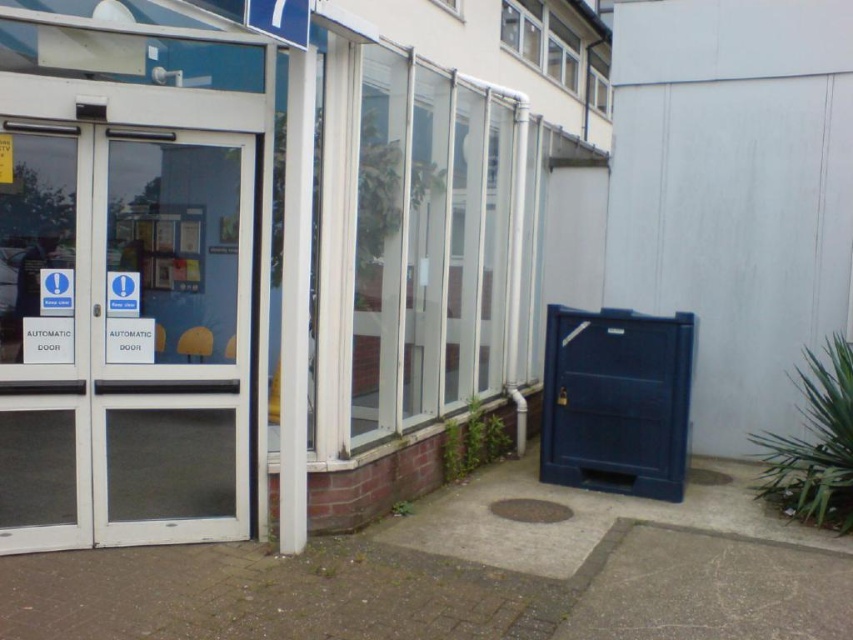
Question: Does transparent glass door at left have a smaller size compared to transparent glass door at center?

Choices:
 (A) no
 (B) yes

Answer: (B)

Question: Does transparent glass door at left have a lesser width compared to transparent glass door at center?

Choices:
 (A) yes
 (B) no

Answer: (B)

Question: Which object appears farthest from the camera in this image?

Choices:
 (A) transparent glass door at center
 (B) transparent glass door at left

Answer: (A)

Question: Does transparent glass door at left have a lesser width compared to transparent glass door at center?

Choices:
 (A) yes
 (B) no

Answer: (B)